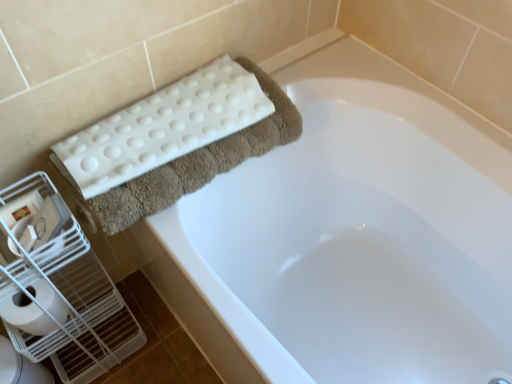
Question: In the image, is white matte toilet paper at lower left on the left side or the right side of white plastic bird cage at left?

Choices:
 (A) right
 (B) left

Answer: (B)

Question: Is white matte toilet paper at lower left taller or shorter than white plastic bird cage at left?

Choices:
 (A) short
 (B) tall

Answer: (A)

Question: Estimate the real-world distances between objects in this image. Which object is closer to the white glossy toilet bowl at lower left?

Choices:
 (A) white rubber mat at upper left
 (B) white textured bath towel at upper left
 (C) white plastic bird cage at left
 (D) white matte toilet paper at lower left

Answer: (D)

Question: Which of these objects is positioned closest to the white plastic bird cage at left?

Choices:
 (A) white glossy toilet bowl at lower left
 (B) white rubber mat at upper left
 (C) white matte toilet paper at lower left
 (D) white textured bath towel at upper left

Answer: (C)